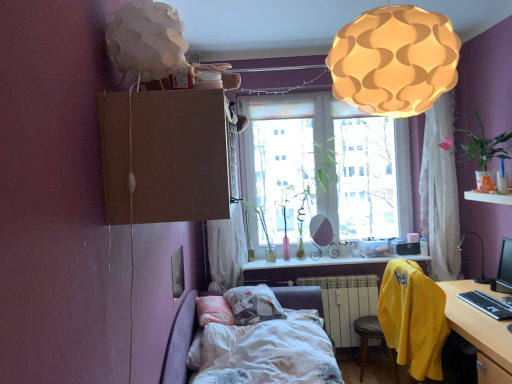
Image resolution: width=512 pixels, height=384 pixels. I want to click on free spot in front of black plastic table lamp at right, so click(479, 286).